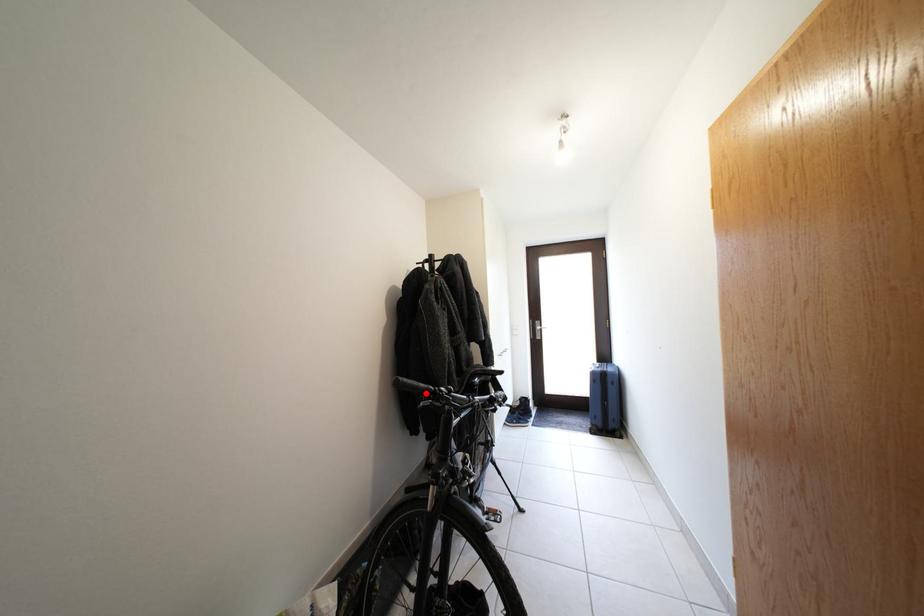
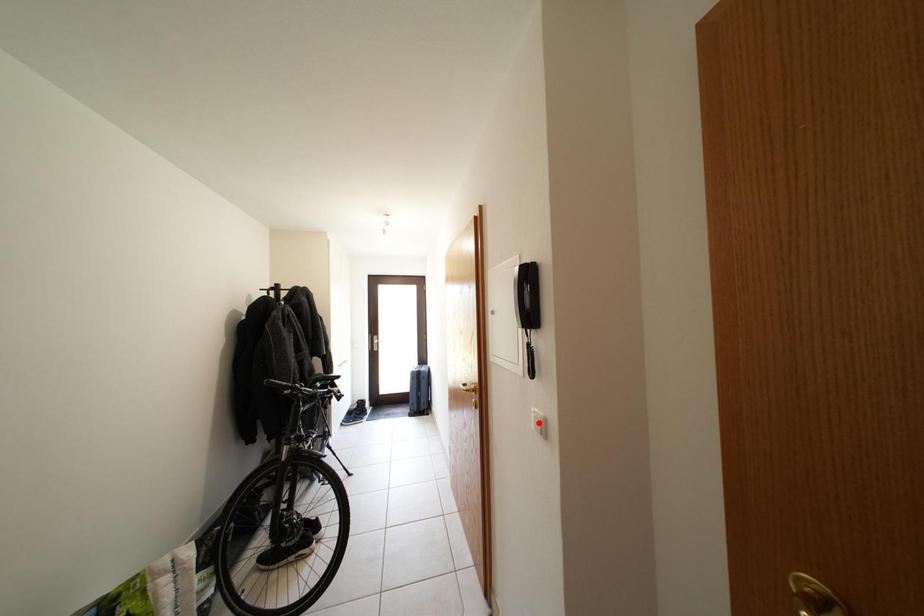
I am providing you with two images of the same scene from different viewpoints. A red point is marked on the first image and another point is marked on the second image. Does the point marked in image1 correspond to the same location as the one in image2?

No